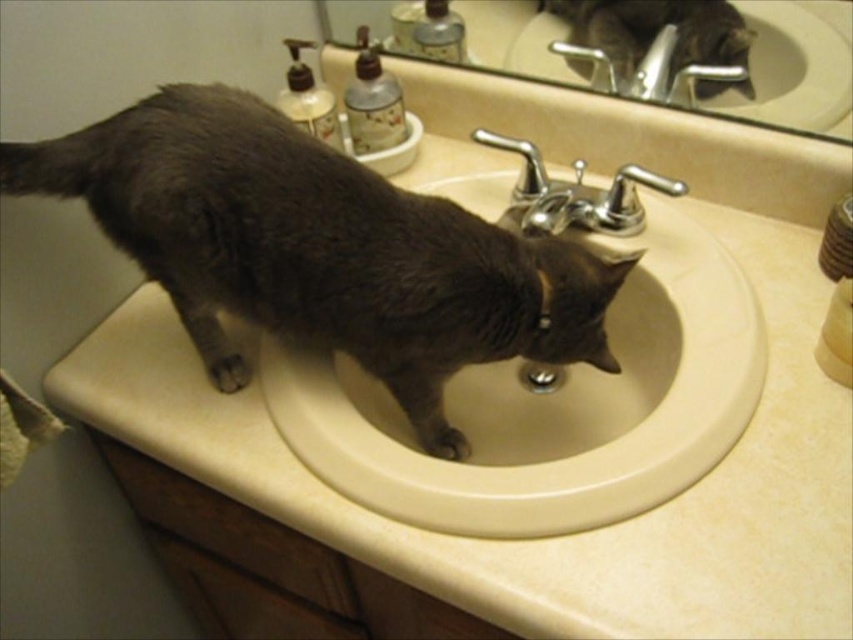
Question: Estimate the real-world distances between objects in this image. Which object is farther from the dark gray fur at sink?

Choices:
 (A) gray fur cat at sink center
 (B) beige ceramic sink at center

Answer: (A)

Question: Does dark gray fur at sink have a larger size compared to beige ceramic sink at center?

Choices:
 (A) no
 (B) yes

Answer: (A)

Question: Based on their relative distances, which object is nearer to the beige ceramic sink at center?

Choices:
 (A) dark gray fur at sink
 (B) gray fur cat at sink center

Answer: (A)

Question: Is dark gray fur at sink behind gray fur cat at sink center?

Choices:
 (A) yes
 (B) no

Answer: (B)

Question: Which point appears closest to the camera in this image?

Choices:
 (A) (614, 289)
 (B) (636, 285)
 (C) (769, 81)

Answer: (A)

Question: Is dark gray fur at sink below beige ceramic sink at center?

Choices:
 (A) yes
 (B) no

Answer: (B)